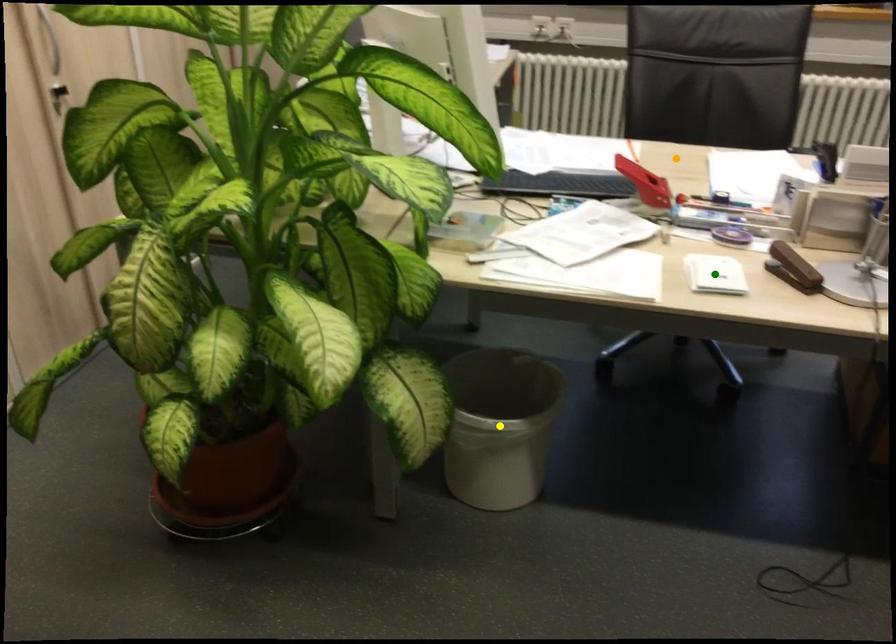
Order these from farthest to nearest:
green point, yellow point, orange point

1. orange point
2. yellow point
3. green point